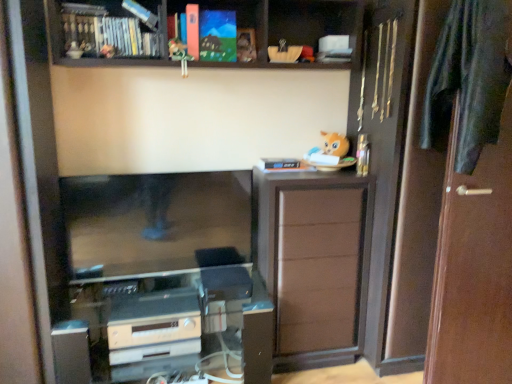
What is the approximate width of wooden bookshelf at upper center?

It is 10.70 inches.

The image size is (512, 384). What do you see at coordinates (468, 79) in the screenshot? I see `dark green fabric at right` at bounding box center [468, 79].

Describe the element at coordinates (217, 36) in the screenshot. I see `matte acrylic painting at upper center, the 2th book when ordered from left to right` at that location.

Measure the distance between matte black tv at center and camera.

They are 6.53 feet apart.

What is the approximate height of matte black tv at center?

62.74 centimeters.

Describe the element at coordinates (179, 55) in the screenshot. I see `metallic figure at upper center, the 2th toy in the right-to-left sequence` at that location.

What is the approximate height of metallic figure at upper center, arranged as the second toy when viewed from the back?

metallic figure at upper center, arranged as the second toy when viewed from the back, is 7.79 inches in height.

Where is `satin silver appliance at lower center`? The width and height of the screenshot is (512, 384). satin silver appliance at lower center is located at coordinates (154, 326).

The image size is (512, 384). What do you see at coordinates (329, 150) in the screenshot?
I see `fluffy plush toy at upper right, the second toy in the front-to-back sequence` at bounding box center [329, 150].

At what (x,y) coordinates should I click in order to perform the action: click on wooden bookshelf at upper center. Please return your answer as a coordinate pair (x, y). Looking at the image, I should click on (200, 31).

From the picture: Is matte black tv at center closer to camera compared to metallic figure at upper center, which is counted as the first toy, starting from the left?

No, matte black tv at center is further to the viewer.

From the image's perspective, is matte black tv at center located beneath metallic figure at upper center, the 2th toy in the right-to-left sequence?

Yes.

Can you tell me how much matte black tv at center and metallic figure at upper center, the 2th toy in the bottom-to-top sequence, differ in facing direction?

The angle between the facing direction of matte black tv at center and the facing direction of metallic figure at upper center, the 2th toy in the bottom-to-top sequence, is 1.97 degrees.

Is matte black tv at center next to metallic figure at upper center, which is the 1th toy from front to back, and touching it?

matte black tv at center is not next to metallic figure at upper center, which is the 1th toy from front to back, and they're not touching.

What's the angular difference between metallic figure at upper center, the 2th toy in the right-to-left sequence, and brown matte cabinet at right's facing directions?

0.248 degrees.

Is metallic figure at upper center, arranged as the second toy when viewed from the back, thinner than brown matte cabinet at right?

Yes.

From a real-world perspective, is metallic figure at upper center, which is the 1th toy from front to back, positioned above or below brown matte cabinet at right?

metallic figure at upper center, which is the 1th toy from front to back, is above brown matte cabinet at right.

Does matte acrylic painting at upper center, the 2th book when ordered from left to right, have a lesser width compared to brown matte cabinet at right?

Yes, matte acrylic painting at upper center, the 2th book when ordered from left to right, is thinner than brown matte cabinet at right.

Is matte acrylic painting at upper center, which ranks as the 1th book in right-to-left order, behind brown matte cabinet at right?

No, matte acrylic painting at upper center, which ranks as the 1th book in right-to-left order, is closer to the camera.

From the picture: Considering the positions of objects matte acrylic painting at upper center, the 2th book when ordered from left to right, and brown matte cabinet at right in the image provided, who is more to the left, matte acrylic painting at upper center, the 2th book when ordered from left to right, or brown matte cabinet at right?

matte acrylic painting at upper center, the 2th book when ordered from left to right, is more to the left.

Can you confirm if matte acrylic painting at upper center, which ranks as the 1th book in right-to-left order, is bigger than brown matte cabinet at right?

Actually, matte acrylic painting at upper center, which ranks as the 1th book in right-to-left order, might be smaller than brown matte cabinet at right.

Can you see dark green fabric at right touching matte acrylic painting at upper center, which ranks as the 1th book in right-to-left order?

No, dark green fabric at right is not in contact with matte acrylic painting at upper center, which ranks as the 1th book in right-to-left order.

Can you confirm if dark green fabric at right is wider than matte acrylic painting at upper center, which ranks as the 1th book in right-to-left order?

Indeed, dark green fabric at right has a greater width compared to matte acrylic painting at upper center, which ranks as the 1th book in right-to-left order.

How many degrees apart are the facing directions of dark green fabric at right and matte acrylic painting at upper center, which ranks as the 1th book in right-to-left order?

The facing directions of dark green fabric at right and matte acrylic painting at upper center, which ranks as the 1th book in right-to-left order, are 3.55 degrees apart.

Is dark green fabric at right bigger or smaller than matte acrylic painting at upper center, which ranks as the 1th book in right-to-left order?

Considering their sizes, dark green fabric at right takes up more space than matte acrylic painting at upper center, which ranks as the 1th book in right-to-left order.

Based on the photo, which is closer, (506, 116) or (78, 57)?

Point (506, 116) is closer to the camera than point (78, 57).

Is brown wood door at right beside wooden bookshelf at upper center?

No, brown wood door at right is not touching wooden bookshelf at upper center.

How far apart are brown wood door at right and wooden bookshelf at upper center?

brown wood door at right and wooden bookshelf at upper center are 4.06 feet apart from each other.

Between brown wood door at right and wooden bookshelf at upper center, which one has less height?

Standing shorter between the two is wooden bookshelf at upper center.

Considering the positions of points (330, 138) and (490, 376), is point (330, 138) closer to camera compared to point (490, 376)?

That is False.

Is fluffy plush toy at upper right, the second toy in the front-to-back sequence, wider than brown wood door at right?

Correct, the width of fluffy plush toy at upper right, the second toy in the front-to-back sequence, exceeds that of brown wood door at right.

Is the depth of fluffy plush toy at upper right, arranged as the second toy when viewed from the top, greater than that of brown wood door at right?

Yes, it is.

How many degrees apart are the facing directions of satin silver appliance at lower center and brown wood door at right?

The angle between the facing direction of satin silver appliance at lower center and the facing direction of brown wood door at right is 5.6 degrees.

Which is more to the left, satin silver appliance at lower center or brown wood door at right?

Positioned to the left is satin silver appliance at lower center.

You are a GUI agent. You are given a task and a screenshot of the screen. Output one action in this format:
    pyautogui.click(x=<x>, y=<y>)
    Task: Click on the door above the satin silver appliance at lower center (from a real-world perspective)
    The image size is (512, 384).
    Given the screenshot: What is the action you would take?
    pyautogui.click(x=474, y=267)

From a real-world perspective, which object rests below the other?

satin silver appliance at lower center is physically lower.

Locate an element on the screen. entertainment center below the metallic figure at upper center, arranged as the second toy when viewed from the back (from a real-world perspective) is located at coordinates (168, 273).

Identify the location of cabinetry on the right of metallic figure at upper center, which is counted as the first toy, starting from the left. This screenshot has height=384, width=512. (314, 261).

Based on their spatial positions, is matte acrylic painting at upper center, the 2th book when ordered from left to right, or matte black book at upper left, the 2th book from the right, further from satin silver appliance at lower center?

matte acrylic painting at upper center, the 2th book when ordered from left to right, is further to satin silver appliance at lower center.

Estimate the real-world distances between objects in this image. Which object is closer to matte black tv at center, dark green fabric at right or brown matte cabinet at right?

brown matte cabinet at right.

When comparing their distances from brown matte cabinet at right, does matte black book at upper left, arranged as the first book when viewed from the left, or matte black tv at center seem closer?

Based on the image, matte black tv at center appears to be nearer to brown matte cabinet at right.

From the image, which object appears to be farther from matte black tv at center, metallic figure at upper center, arranged as the second toy when viewed from the back, or dark green fabric at right?

dark green fabric at right lies further to matte black tv at center than the other object.

Which object lies further to the anchor point wooden bookshelf at upper center, metallic figure at upper center, marked as the 1th toy in a top-to-bottom arrangement, or satin silver appliance at lower center?

Among the two, satin silver appliance at lower center is located further to wooden bookshelf at upper center.

Considering their positions, is dark green fabric at right positioned further to matte black tv at center than matte acrylic painting at upper center, which ranks as the 1th book in right-to-left order?

Among the two, dark green fabric at right is located further to matte black tv at center.

Considering their positions, is metallic figure at upper center, the 2th toy in the bottom-to-top sequence, positioned closer to brown wood door at right than matte black book at upper left, arranged as the first book when viewed from the left?

metallic figure at upper center, the 2th toy in the bottom-to-top sequence, lies closer to brown wood door at right than the other object.

Based on their spatial positions, is matte acrylic painting at upper center, which ranks as the 1th book in right-to-left order, or metallic figure at upper center, which is counted as the first toy, starting from the left, further from brown wood door at right?

Among the two, metallic figure at upper center, which is counted as the first toy, starting from the left, is located further to brown wood door at right.

Image resolution: width=512 pixels, height=384 pixels. Identify the location of entertainment center situated between matte black book at upper left, arranged as the first book when viewed from the left, and fluffy plush toy at upper right, marked as the 1th toy in a right-to-left arrangement, from left to right. (168, 273).

I want to click on clothe situated between satin silver appliance at lower center and brown wood door at right from left to right, so click(x=468, y=79).

Locate an element on the screen. This screenshot has height=384, width=512. toy between matte black tv at center and fluffy plush toy at upper right, marked as the 1th toy in a right-to-left arrangement, in the horizontal direction is located at coordinates point(179,55).

This screenshot has width=512, height=384. I want to click on book located between wooden bookshelf at upper center and fluffy plush toy at upper right, marked as the 1th toy in a right-to-left arrangement, in the left-right direction, so click(217, 36).